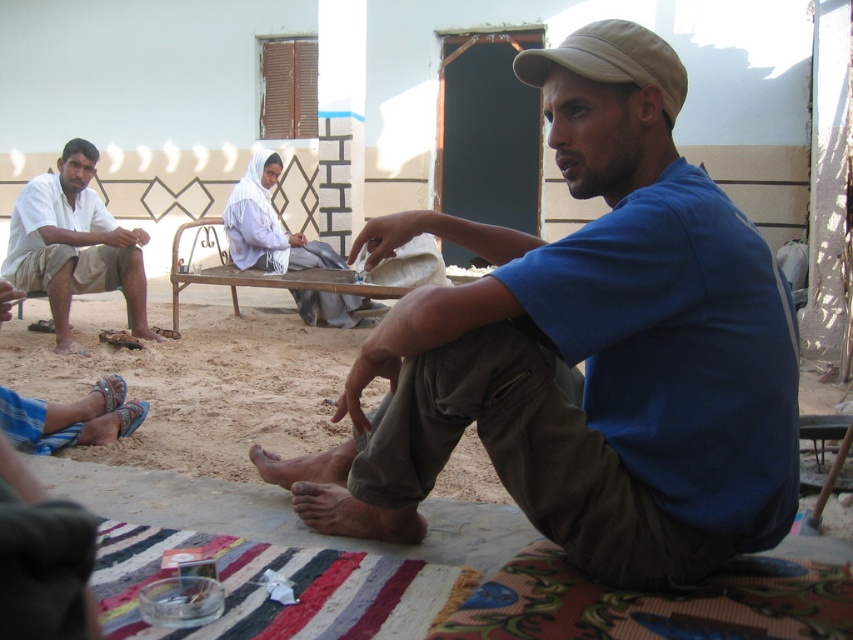
Question: Can you confirm if blue cotton shirt at center is smaller than khaki fabric cap at upper right?

Choices:
 (A) yes
 (B) no

Answer: (B)

Question: Which of the following is the farthest from the observer?

Choices:
 (A) blue cotton shirt at center
 (B) white cotton shirt at left

Answer: (B)

Question: Which point appears closest to the camera in this image?

Choices:
 (A) (517, 68)
 (B) (76, 241)
 (C) (579, 548)

Answer: (C)

Question: Which point is closer to the camera?

Choices:
 (A) (96, 230)
 (B) (581, 33)
 (C) (576, 468)

Answer: (C)

Question: Is blue cotton shirt at center wider than khaki fabric cap at upper right?

Choices:
 (A) no
 (B) yes

Answer: (B)

Question: Is white cotton shirt at left to the right of khaki fabric cap at upper right from the viewer's perspective?

Choices:
 (A) no
 (B) yes

Answer: (A)